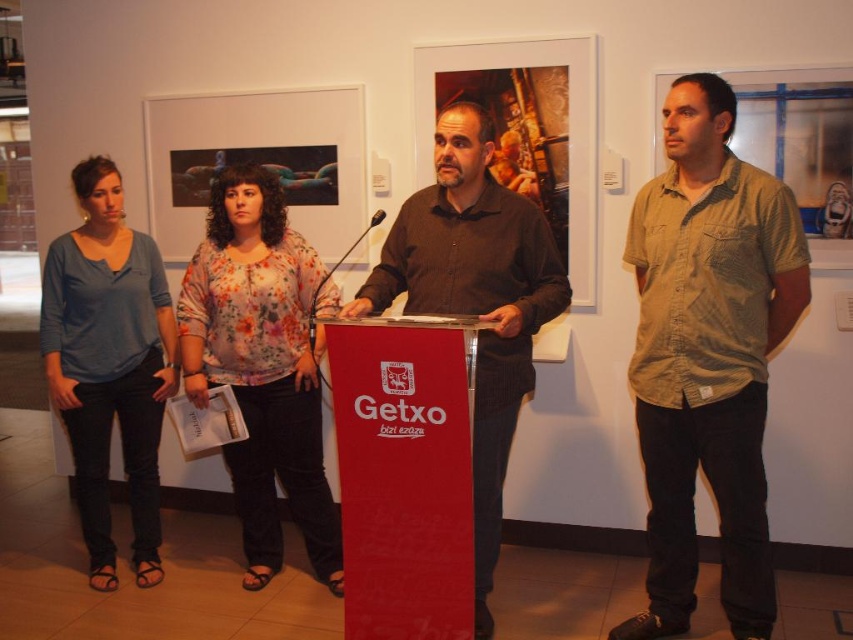
Between point (252, 464) and point (82, 282), which one is positioned in front?

Point (82, 282) is in front.

The width and height of the screenshot is (853, 640). What do you see at coordinates (262, 365) in the screenshot? I see `floral print blouse at center` at bounding box center [262, 365].

Locate an element on the screen. The height and width of the screenshot is (640, 853). floral print blouse at center is located at coordinates (262, 365).

Find the location of `floral print blouse at center`. floral print blouse at center is located at coordinates (262, 365).

How far apart are floral print blouse at center and dark brown shirt at center?

floral print blouse at center is 28.00 inches from dark brown shirt at center.

Between point (233, 316) and point (473, 260), which one is positioned behind?

The point (233, 316) is behind.

I want to click on floral print blouse at center, so click(x=262, y=365).

In the scene shown: Who is shorter, khaki cotton shirt at right or floral print blouse at center?

floral print blouse at center is shorter.

At what (x,y) coordinates should I click in order to perform the action: click on khaki cotton shirt at right. Please return your answer as a coordinate pair (x, y). This screenshot has width=853, height=640. Looking at the image, I should click on (708, 355).

The width and height of the screenshot is (853, 640). In order to click on khaki cotton shirt at right in this screenshot , I will do `click(708, 355)`.